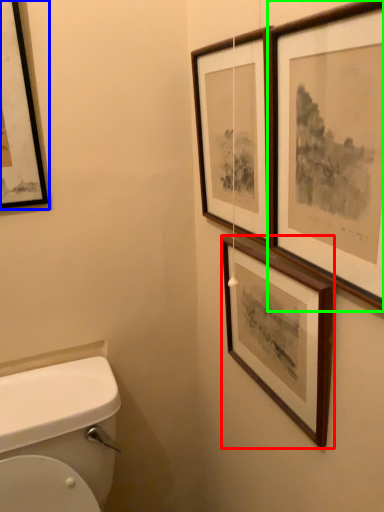
Question: Which object is the closest to the picture frame (highlighted by a red box)? Choose among these: picture frame (highlighted by a blue box) or picture frame (highlighted by a green box).

Choices:
 (A) picture frame
 (B) picture frame

Answer: (B)